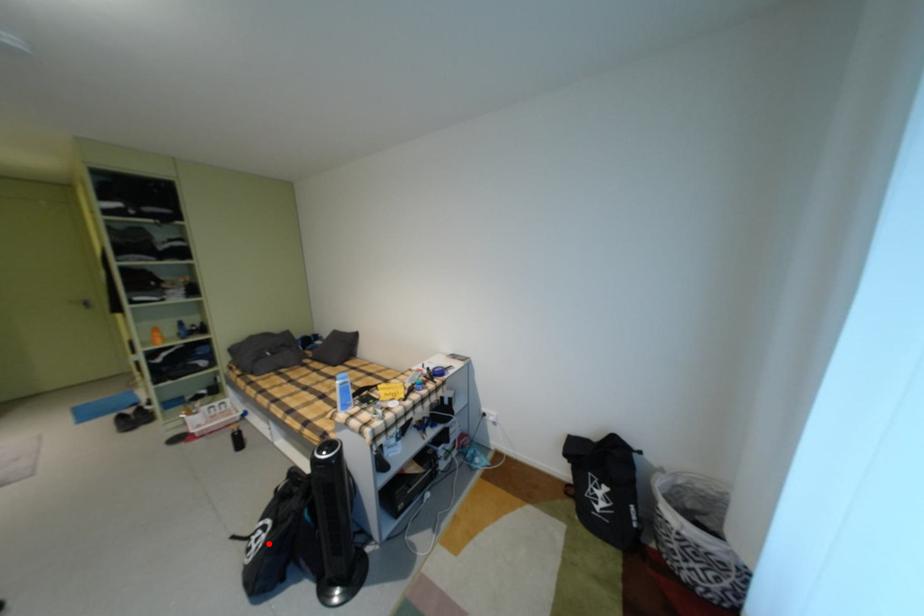
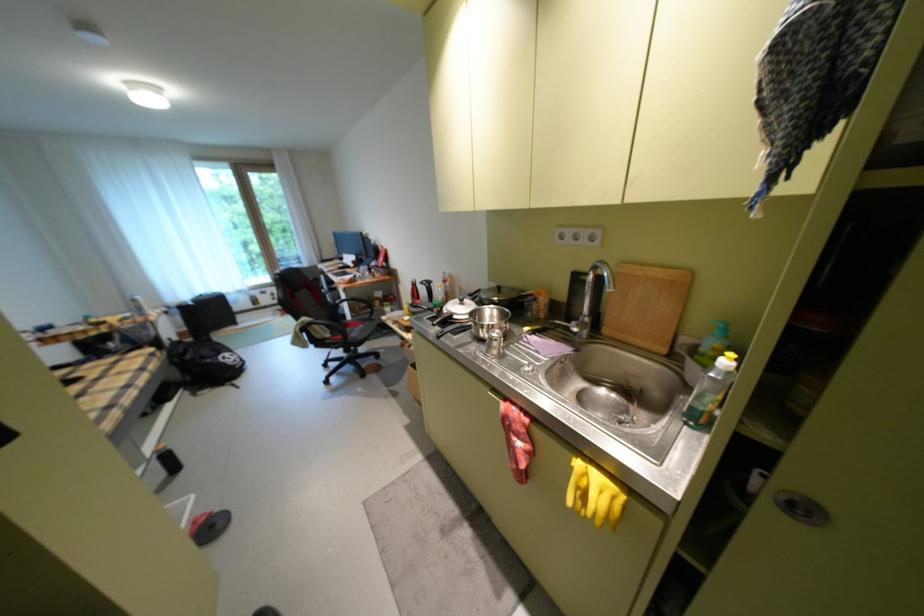
Question: I am providing you with two images of the same scene from different viewpoints. A red point is marked on the first image. At the location where the point appears in image 1, is it still visible in image 2?

Choices:
 (A) Yes
 (B) No

Answer: (A)